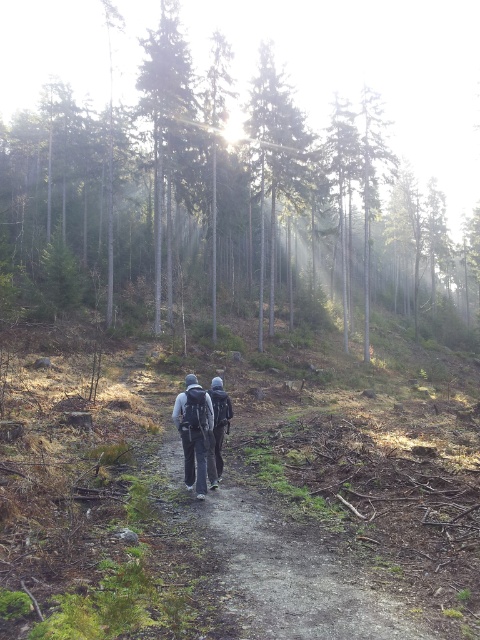
Who is shorter, smooth silver pole at center or dark gray fabric jacket at center?

dark gray fabric jacket at center

From the picture: Who is more distant from viewer, (266, 83) or (213, 481)?

The point (266, 83) is behind.

Where is `smooth silver pole at center`? The height and width of the screenshot is (640, 480). smooth silver pole at center is located at coordinates (274, 157).

Measure the distance between point (348, 593) and camera.

Point (348, 593) is 6.48 meters from camera.

Does dirt path at center have a larger size compared to smooth silver pole at center?

No, dirt path at center is not bigger than smooth silver pole at center.

Between point (362, 621) and point (286, 100), which one is positioned behind?

The point (286, 100) is more distant.

What are the coordinates of `dirt path at center` in the screenshot? It's located at (292, 570).

Does green matte trees at upper center have a larger size compared to smooth silver pole at center?

Indeed, green matte trees at upper center has a larger size compared to smooth silver pole at center.

Does green matte trees at upper center appear under smooth silver pole at center?

Incorrect, green matte trees at upper center is not positioned below smooth silver pole at center.

Is point (121, 60) positioned before point (275, 118)?

That is False.

In order to click on green matte trees at upper center in this screenshot , I will do `click(369, 70)`.